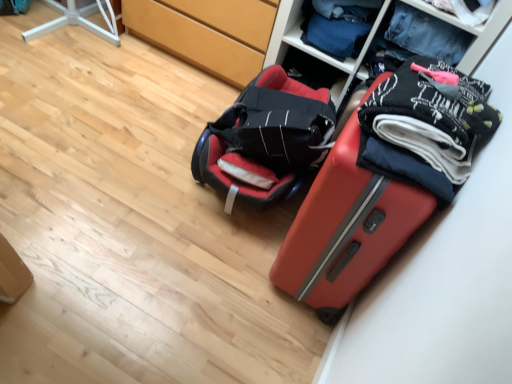
Find the location of a particular element. This screenshot has height=384, width=512. black cotton socks at upper right, the 2th clothing from the back is located at coordinates [428, 124].

Find the location of a particular element. The image size is (512, 384). black cotton socks at upper right, which ranks as the 2th clothing in top-to-bottom order is located at coordinates (428, 124).

Between black cotton socks at upper right, the first clothing ordered from the bottom, and denim jeans at upper right, placed as the 1th clothing when sorted from back to front, which one has less height?

Standing shorter between the two is black cotton socks at upper right, the first clothing ordered from the bottom.

In the scene shown: Is black cotton socks at upper right, the 2th clothing from the back, located outside denim jeans at upper right, which ranks as the second clothing in bottom-to-top order?

That's correct, black cotton socks at upper right, the 2th clothing from the back, is outside of denim jeans at upper right, which ranks as the second clothing in bottom-to-top order.

Does point (442, 88) appear closer or farther from the camera than point (333, 55)?

Point (442, 88) appears to be closer to the viewer than point (333, 55).

From the image's perspective, is black cotton socks at upper right, which ranks as the 2th clothing in top-to-bottom order, beneath denim jeans at upper right, which ranks as the first clothing in top-to-bottom order?

Yes, from the image's perspective, black cotton socks at upper right, which ranks as the 2th clothing in top-to-bottom order, is beneath denim jeans at upper right, which ranks as the first clothing in top-to-bottom order.

Is denim jeans at upper right, which ranks as the second clothing in bottom-to-top order, facing towards black cotton socks at upper right, which ranks as the 2th clothing in top-to-bottom order?

No.

Between denim jeans at upper right, the second clothing in the front-to-back sequence, and black cotton socks at upper right, the first clothing from the front, which one is positioned in front?

black cotton socks at upper right, the first clothing from the front, is in front.

Looking at this image, is denim jeans at upper right, the second clothing in the front-to-back sequence, inside the boundaries of black cotton socks at upper right, which ranks as the 2th clothing in top-to-bottom order, or outside?

denim jeans at upper right, the second clothing in the front-to-back sequence, cannot be found inside black cotton socks at upper right, which ranks as the 2th clothing in top-to-bottom order.

From the image's perspective, is denim jeans at upper right, which ranks as the first clothing in top-to-bottom order, below black cotton socks at upper right, the first clothing ordered from the bottom?

No, from the image's perspective, denim jeans at upper right, which ranks as the first clothing in top-to-bottom order, is not below black cotton socks at upper right, the first clothing ordered from the bottom.

In the image, is black cotton socks at upper right, which ranks as the 2th clothing in top-to-bottom order, on the left side or the right side of matte red suitcase at lower right?

Clearly, black cotton socks at upper right, which ranks as the 2th clothing in top-to-bottom order, is on the right of matte red suitcase at lower right in the image.

Which of these two, black cotton socks at upper right, which ranks as the 2th clothing in top-to-bottom order, or matte red suitcase at lower right, is wider?

Wider between the two is matte red suitcase at lower right.

From the image's perspective, is black cotton socks at upper right, the first clothing from the front, on top of matte red suitcase at lower right?

Yes, from the image's perspective, black cotton socks at upper right, the first clothing from the front, is above matte red suitcase at lower right.

From a real-world perspective, which object stands above the other?

black cotton socks at upper right, the first clothing ordered from the bottom, is physically above.

From the image's perspective, which one is positioned higher, denim jeans at upper right, which ranks as the first clothing in top-to-bottom order, or matte black bag at center?

denim jeans at upper right, which ranks as the first clothing in top-to-bottom order, is shown above in the image.

Which object is positioned more to the left, denim jeans at upper right, which ranks as the first clothing in top-to-bottom order, or matte black bag at center?

Positioned to the left is matte black bag at center.

In terms of height, does denim jeans at upper right, which ranks as the first clothing in top-to-bottom order, look taller or shorter compared to matte black bag at center?

denim jeans at upper right, which ranks as the first clothing in top-to-bottom order, is taller than matte black bag at center.

From a real-world perspective, is denim jeans at upper right, which ranks as the second clothing in bottom-to-top order, positioned over matte black bag at center based on gravity?

Correct, in the physical world, denim jeans at upper right, which ranks as the second clothing in bottom-to-top order, is higher than matte black bag at center.

From the image's perspective, is textured fabric clothes at upper right under matte red suitcase at lower right?

No.

Considering the sizes of objects textured fabric clothes at upper right and matte red suitcase at lower right in the image provided, who is thinner, textured fabric clothes at upper right or matte red suitcase at lower right?

With smaller width is matte red suitcase at lower right.

Is textured fabric clothes at upper right to the left of matte red suitcase at lower right from the viewer's perspective?

No, textured fabric clothes at upper right is not to the left of matte red suitcase at lower right.

Would you say textured fabric clothes at upper right is a long distance from matte red suitcase at lower right?

No, textured fabric clothes at upper right is not far away from matte red suitcase at lower right.

Is matte black bag at center wider or thinner than matte red suitcase at lower right?

matte black bag at center is wider than matte red suitcase at lower right.

Is matte black bag at center not close to matte red suitcase at lower right?

No.

From the image's perspective, between matte black bag at center and matte red suitcase at lower right, which one is located above?

matte black bag at center appears higher in the image.

How different are the orientations of matte black bag at center and matte red suitcase at lower right in degrees?

They differ by 2.26 degrees in their facing directions.

From the image's perspective, which is below, matte black bag at center or denim jeans at upper right, which ranks as the second clothing in bottom-to-top order?

matte black bag at center appears lower in the image.

Is matte black bag at center not inside denim jeans at upper right, the second clothing in the front-to-back sequence?

matte black bag at center lies outside denim jeans at upper right, the second clothing in the front-to-back sequence,'s area.

Does matte black bag at center have a lesser width compared to denim jeans at upper right, placed as the 1th clothing when sorted from back to front?

No, matte black bag at center is not thinner than denim jeans at upper right, placed as the 1th clothing when sorted from back to front.

In order to click on clothing below the denim jeans at upper right, which ranks as the first clothing in top-to-bottom order (from the image's perspective) in this screenshot , I will do `click(428, 124)`.

Find the location of a particular element. The width and height of the screenshot is (512, 384). clothing located underneath the black cotton socks at upper right, the first clothing ordered from the bottom (from a real-world perspective) is located at coordinates (338, 25).

Looking at this image, when comparing their distances from matte red suitcase at lower right, does matte black bag at center or matte wood cabinet at center seem closer?

matte black bag at center.

Looking at the image, which one is located further to matte black bag at center, matte wood cabinet at center or textured fabric clothes at upper right?

matte wood cabinet at center.

From the image, which object appears to be nearer to black cotton socks at upper right, the 2th clothing from the back, textured fabric clothes at upper right or matte black bag at center?

matte black bag at center lies closer to black cotton socks at upper right, the 2th clothing from the back, than the other object.

Estimate the real-world distances between objects in this image. Which object is further from matte wood cabinet at center, denim jeans at upper right, placed as the 1th clothing when sorted from back to front, or matte black bag at center?

The object further to matte wood cabinet at center is matte black bag at center.

Estimate the real-world distances between objects in this image. Which object is further from textured fabric clothes at upper right, matte wood cabinet at center or matte red suitcase at lower right?

matte red suitcase at lower right lies further to textured fabric clothes at upper right than the other object.

Based on their spatial positions, is denim jeans at upper right, which ranks as the first clothing in top-to-bottom order, or matte black bag at center further from matte red suitcase at lower right?

Based on the image, denim jeans at upper right, which ranks as the first clothing in top-to-bottom order, appears to be further to matte red suitcase at lower right.

Considering their positions, is denim jeans at upper right, placed as the 1th clothing when sorted from back to front, positioned closer to matte black bag at center than matte red suitcase at lower right?

Among the two, matte red suitcase at lower right is located nearer to matte black bag at center.

When comparing their distances from matte red suitcase at lower right, does black cotton socks at upper right, the 2th clothing from the back, or matte black bag at center seem further?

matte black bag at center is further to matte red suitcase at lower right.

I want to click on shelf located between black cotton socks at upper right, which ranks as the 2th clothing in top-to-bottom order, and denim jeans at upper right, the second clothing in the front-to-back sequence, in the depth direction, so tap(312, 47).

Where is `luggage and bags located between black cotton socks at upper right, the 2th clothing from the back, and textured fabric clothes at upper right in the depth direction`? This screenshot has width=512, height=384. luggage and bags located between black cotton socks at upper right, the 2th clothing from the back, and textured fabric clothes at upper right in the depth direction is located at coordinates (265, 140).

Where is `suitcase between black cotton socks at upper right, which ranks as the 2th clothing in top-to-bottom order, and matte black bag at center from front to back`? The width and height of the screenshot is (512, 384). suitcase between black cotton socks at upper right, which ranks as the 2th clothing in top-to-bottom order, and matte black bag at center from front to back is located at coordinates (382, 181).

You are a GUI agent. You are given a task and a screenshot of the screen. Output one action in this format:
    pyautogui.click(x=<x>, y=<y>)
    Task: Click on the clothing located between black cotton socks at upper right, the first clothing from the front, and matte wood cabinet at center in the depth direction
    This screenshot has height=384, width=512.
    Given the screenshot: What is the action you would take?
    pyautogui.click(x=338, y=25)